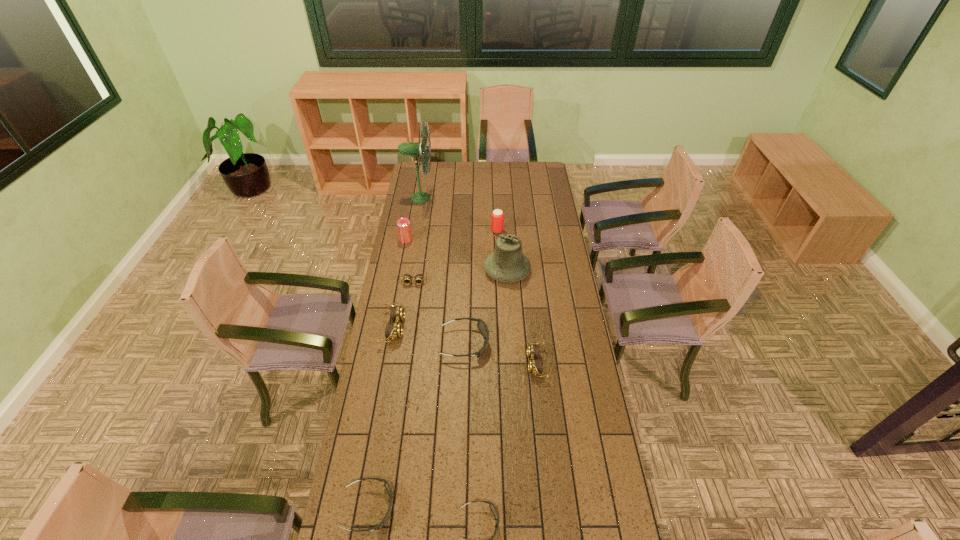
The width and height of the screenshot is (960, 540). I want to click on vacant position in the image that satisfies the following two spatial constraints: 1. through the lenses of the farthest goggles; 2. through the lenses of the sixth shortest object, so click(407, 328).